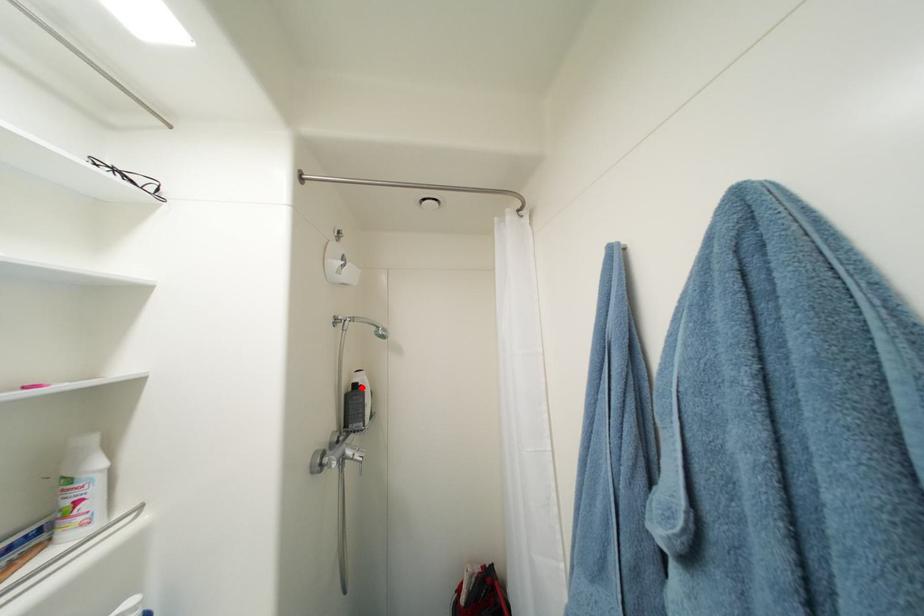
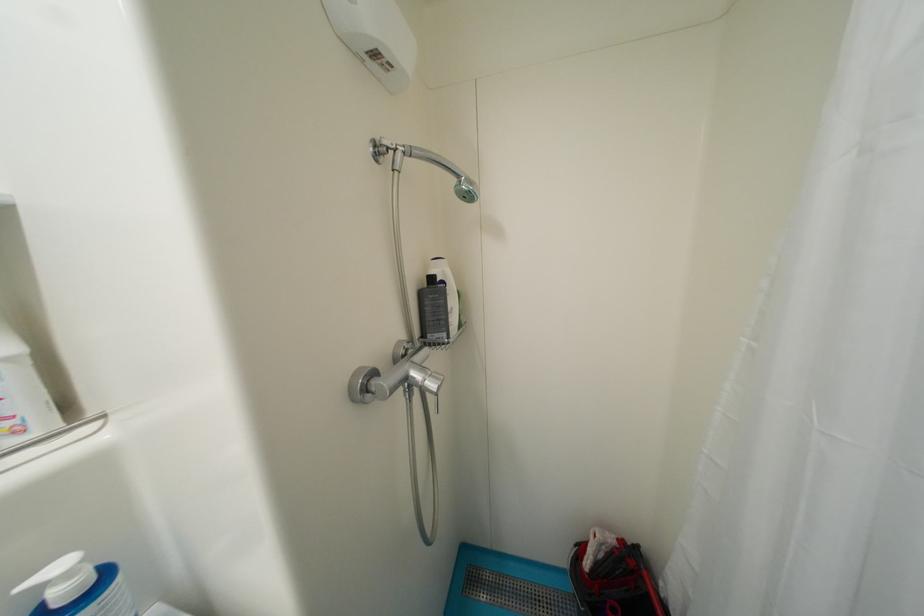
Find the pixel in the second image that matches the highlighted location in the first image.

(439, 281)